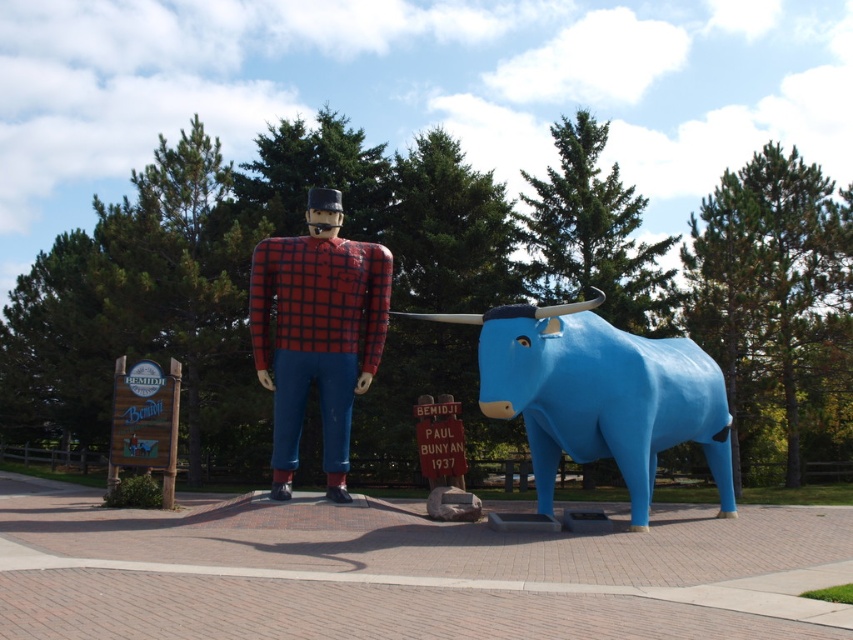
Question: Is blue glossy bull at center behind red plaid shirt at center?

Choices:
 (A) yes
 (B) no

Answer: (A)

Question: Which object appears farthest from the camera in this image?

Choices:
 (A) blue glossy bull at center
 (B) red plaid shirt at center

Answer: (A)

Question: Among these points, which one is farthest from the camera?

Choices:
 (A) (328, 356)
 (B) (550, 342)

Answer: (A)

Question: Considering the relative positions of blue glossy bull at center and red plaid shirt at center in the image provided, where is blue glossy bull at center located with respect to red plaid shirt at center?

Choices:
 (A) above
 (B) below

Answer: (B)

Question: Can you confirm if blue glossy bull at center is smaller than red plaid shirt at center?

Choices:
 (A) no
 (B) yes

Answer: (B)